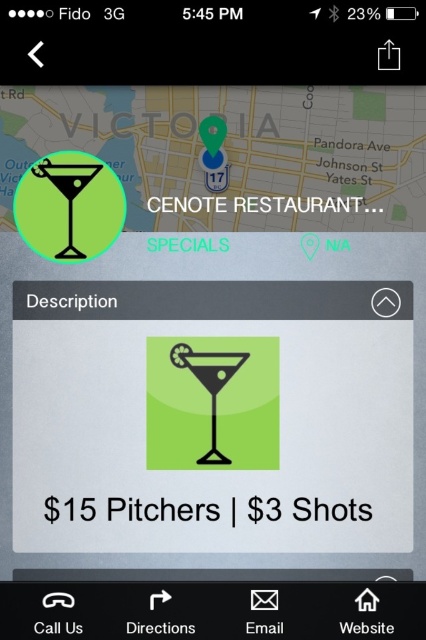
You are using a navigation app to find the Cenote Restaurant in Victoria. The app shows a map with a green pin and a green martini glass icon. There is also a point marked at coordinates (296, 204). Which object on the map does this point correspond to?

The point at coordinates (296, 204) corresponds to the green matte martini glass at upper left.

You are trying to decide which glass to use for your drink. The green matte martini glass at upper left and the matte glass at center are both available. Which one has a larger opening?

The green matte martini glass at upper left might be wider than matte glass at center, so it likely has a larger opening.

You are holding a phone showing the Cenote Restaurant location. A point on the screen is at coordinates (196, 204). If your thumb is 29.41 inches away from the screen, can you cover that point with your thumb without moving the phone?

→ The point at (196, 204) is 29.41 inches away from the viewer. Since your thumb is at the same distance, you can cover the point with your thumb without moving the phone.